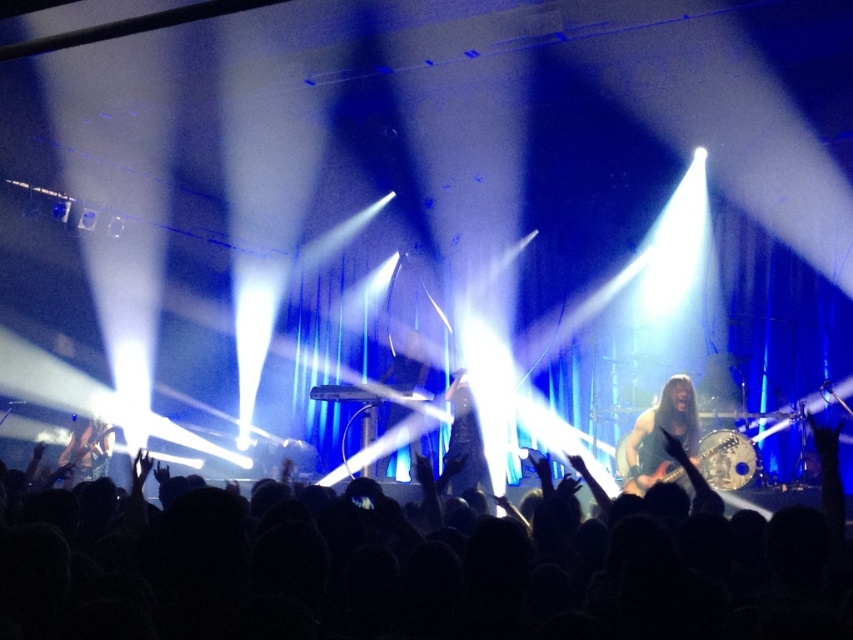
Question: Does shiny black guitar at center lie in front of shiny metallic guitar at center?

Choices:
 (A) yes
 (B) no

Answer: (A)

Question: Can you confirm if black hair at center is wider than black leather jacket at center?

Choices:
 (A) yes
 (B) no

Answer: (A)

Question: Can you confirm if shiny black guitar at center is positioned to the left of black leather jacket at center?

Choices:
 (A) no
 (B) yes

Answer: (A)

Question: Among these points, which one is farthest from the camera?

Choices:
 (A) (642, 436)
 (B) (77, 472)
 (C) (723, 486)

Answer: (B)

Question: Which of the following is the closest to the observer?

Choices:
 (A) (461, 422)
 (B) (721, 456)

Answer: (B)

Question: Among these points, which one is farthest from the camera?

Choices:
 (A) (483, 522)
 (B) (83, 435)
 (C) (651, 476)
 (D) (670, 388)

Answer: (B)